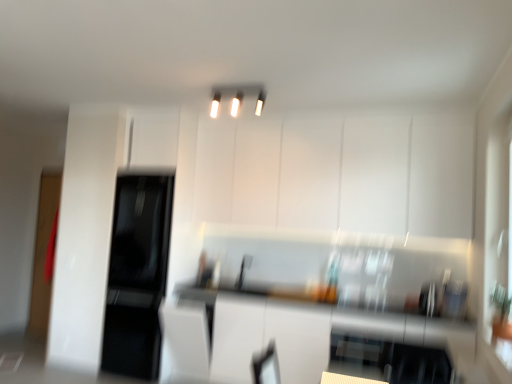
Question: Does white glossy cabinet at upper center have a larger size compared to black glossy refrigerator at left?

Choices:
 (A) yes
 (B) no

Answer: (A)

Question: Is white glossy cabinet at upper center shorter than black glossy refrigerator at left?

Choices:
 (A) no
 (B) yes

Answer: (B)

Question: Is white glossy cabinet at upper center aimed at black glossy refrigerator at left?

Choices:
 (A) yes
 (B) no

Answer: (B)

Question: Is white glossy cabinet at upper center further to the viewer compared to black glossy refrigerator at left?

Choices:
 (A) yes
 (B) no

Answer: (B)

Question: Is black glossy refrigerator at left completely or partially inside white glossy cabinet at upper center?

Choices:
 (A) no
 (B) yes

Answer: (A)

Question: Is point (212, 163) closer or farther from the camera than point (139, 309)?

Choices:
 (A) farther
 (B) closer

Answer: (B)

Question: Considering the positions of white glossy cabinet at upper center and black glossy refrigerator at left in the image, is white glossy cabinet at upper center taller or shorter than black glossy refrigerator at left?

Choices:
 (A) tall
 (B) short

Answer: (B)

Question: From the image's perspective, is white glossy cabinet at upper center positioned above or below black glossy refrigerator at left?

Choices:
 (A) below
 (B) above

Answer: (B)

Question: From a real-world perspective, is white glossy cabinet at upper center above or below black glossy refrigerator at left?

Choices:
 (A) below
 (B) above

Answer: (B)

Question: Is point (261, 82) closer or farther from the camera than point (423, 155)?

Choices:
 (A) farther
 (B) closer

Answer: (B)

Question: Is white glossy light fixture at upper center in front of or behind white glossy cabinet at upper center in the image?

Choices:
 (A) behind
 (B) front

Answer: (B)

Question: Is white glossy light fixture at upper center wider or thinner than white glossy cabinet at upper center?

Choices:
 (A) thin
 (B) wide

Answer: (A)

Question: In the image, is white glossy light fixture at upper center on the left side or the right side of white glossy cabinet at upper center?

Choices:
 (A) left
 (B) right

Answer: (A)

Question: From the image's perspective, is white glossy countertop at center positioned above or below white glossy cabinet at upper center?

Choices:
 (A) above
 (B) below

Answer: (B)

Question: Is point (262, 317) positioned closer to the camera than point (272, 142)?

Choices:
 (A) farther
 (B) closer

Answer: (B)